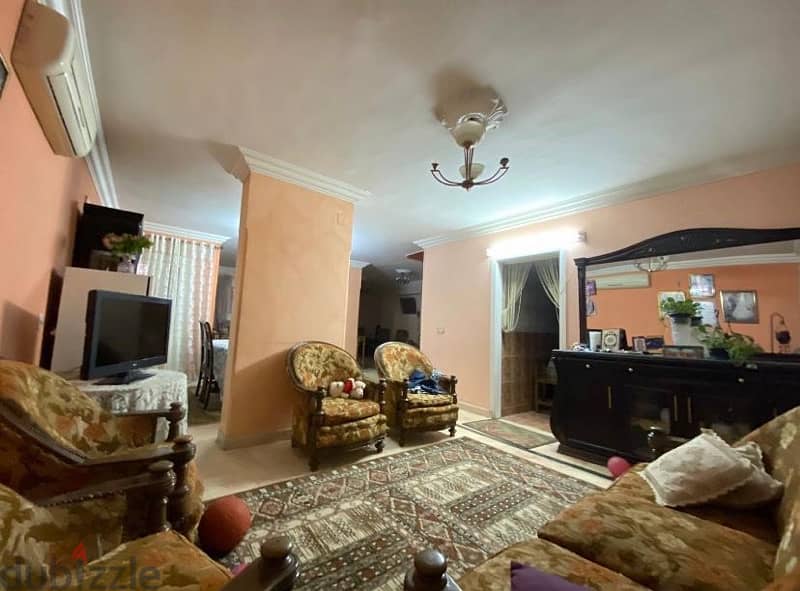
Identify the location of walls. (x=10, y=224), (x=214, y=274), (x=233, y=269), (x=278, y=272), (x=356, y=294), (x=410, y=296), (x=462, y=289), (x=697, y=207), (x=784, y=300).